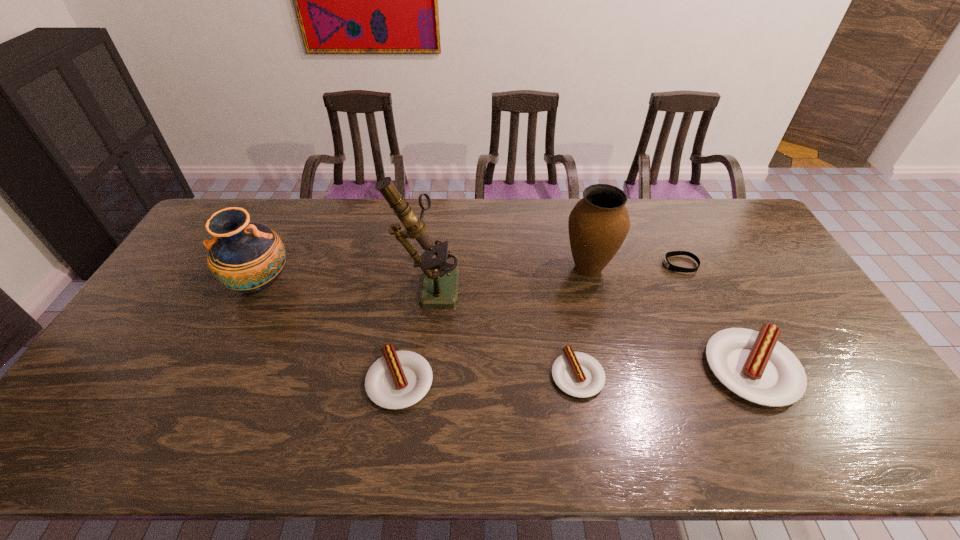
Find the location of a particular element. This screenshot has height=540, width=960. the second shortest sausage is located at coordinates pos(399,379).

Find the location of a particular element. the fifth tallest object is located at coordinates (399, 379).

Identify the location of the shortest sausage. (580, 375).

I want to click on the second shortest object, so point(580,375).

Where is `the rightmost sausage`? Image resolution: width=960 pixels, height=540 pixels. the rightmost sausage is located at coordinates (754, 365).

Find the location of a particular element. the tallest sausage is located at coordinates (754, 365).

Identify the location of wristband. This screenshot has width=960, height=540. (669, 266).

Locate an element on the screen. microscope is located at coordinates (440, 280).

In order to click on pottery in this screenshot , I will do `click(248, 257)`.

In order to click on urn in this screenshot , I will do `click(598, 224)`.